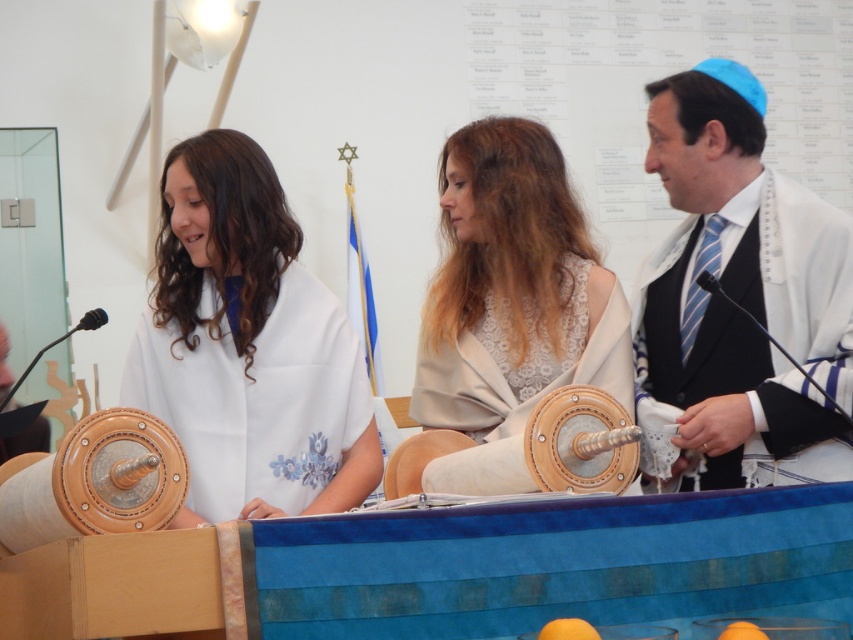
Question: Which of the following is the closest to the observer?

Choices:
 (A) (828, 433)
 (B) (428, 294)
 (C) (257, 216)

Answer: (A)

Question: In this image, where is lace fabric shawl at center located relative to white textured robe at right?

Choices:
 (A) below
 (B) above

Answer: (A)

Question: Does white matte shawl at center have a greater width compared to white textured robe at right?

Choices:
 (A) yes
 (B) no

Answer: (A)

Question: Among these points, which one is nearest to the camera?

Choices:
 (A) (805, 314)
 (B) (260, 164)

Answer: (A)

Question: Among these objects, which one is farthest from the camera?

Choices:
 (A) lace fabric shawl at center
 (B) white matte shawl at center

Answer: (B)

Question: Does lace fabric shawl at center appear on the right side of white textured robe at right?

Choices:
 (A) yes
 (B) no

Answer: (B)